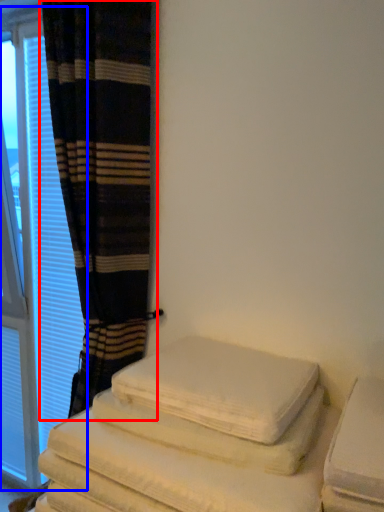
Question: Among these objects, which one is farthest to the camera, curtain (highlighted by a red box) or window (highlighted by a blue box)?

Choices:
 (A) curtain
 (B) window

Answer: (B)